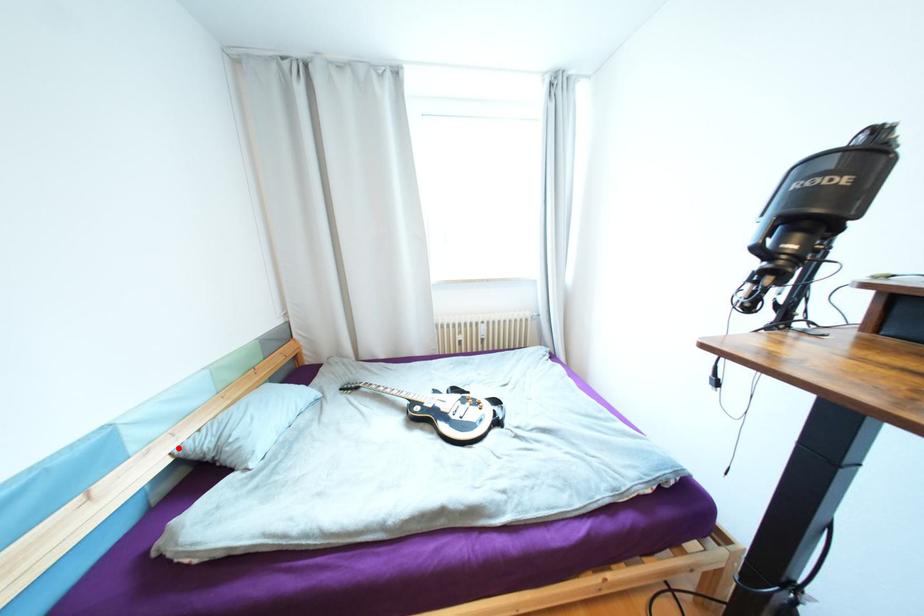
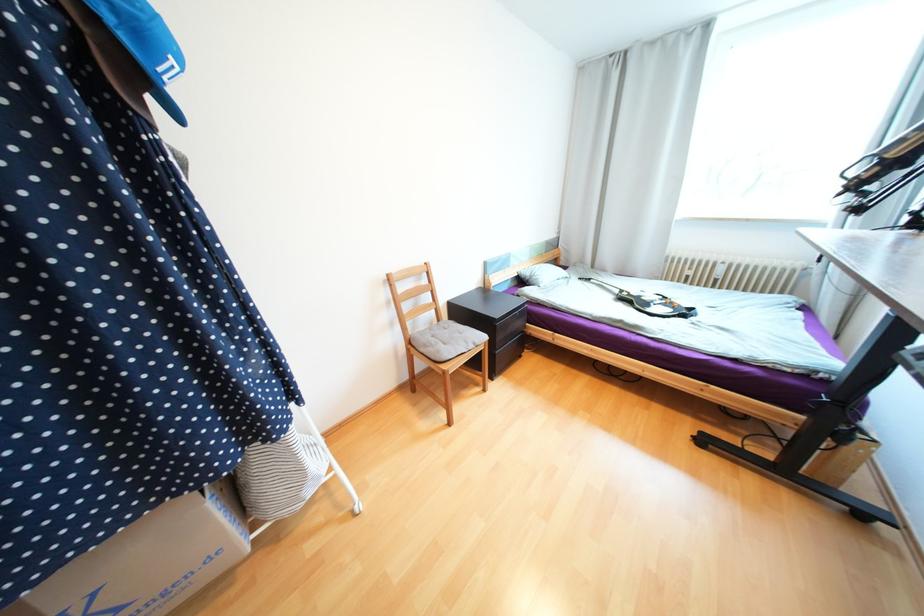
Where in the second image is the point corresponding to the highlighted location from the first image?

(524, 270)